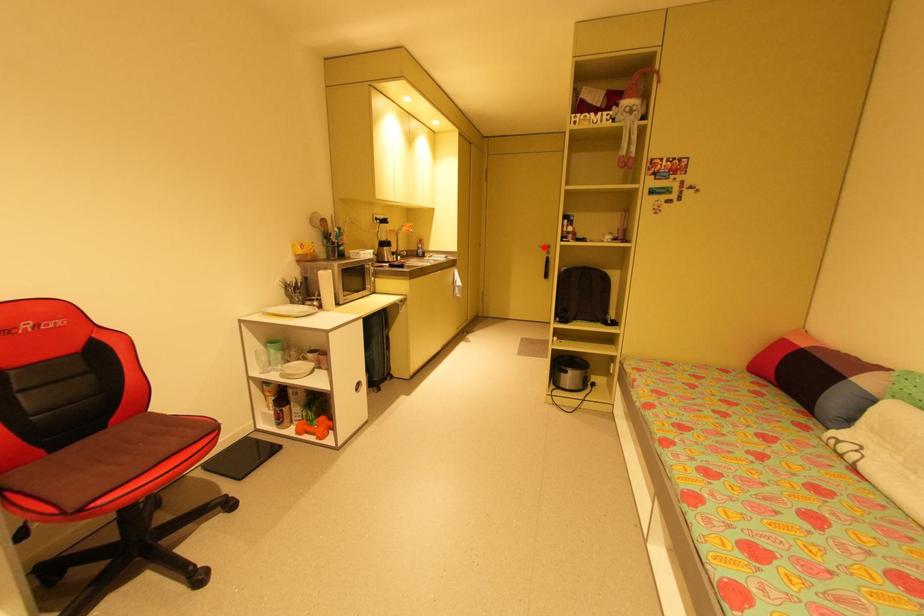
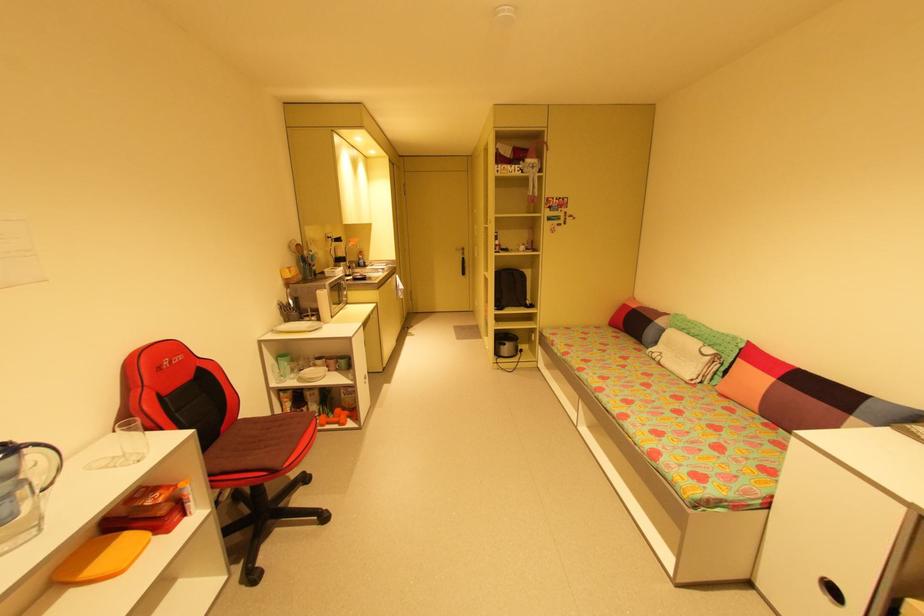
Question: I am providing you with two images of the same scene from different viewpoints. Given a red point in image1, look at the same physical point in image2. Is it:

Choices:
 (A) Closer to the viewpoint
 (B) Farther from the viewpoint

Answer: (A)